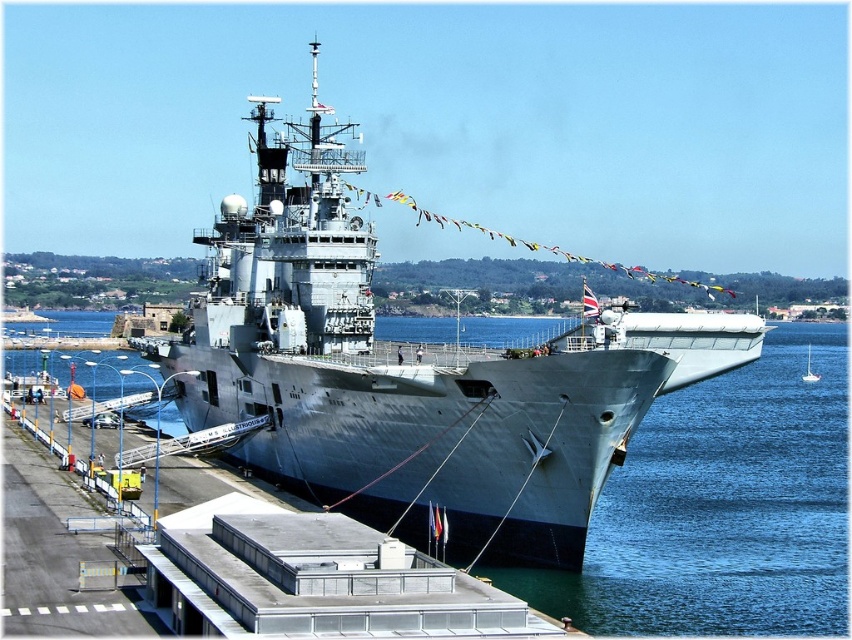
Question: Which object is farther from the camera taking this photo?

Choices:
 (A) gray metallic water at center
 (B) gray metallic ship at center

Answer: (A)

Question: Can you confirm if gray metallic ship at center is smaller than white glossy sailboat at center?

Choices:
 (A) yes
 (B) no

Answer: (B)

Question: Which object is closer to the camera taking this photo?

Choices:
 (A) gray metallic ship at center
 (B) white glossy sailboat at center
 (C) gray metallic water at center

Answer: (A)

Question: From the image, what is the correct spatial relationship of gray metallic ship at center in relation to gray metallic water at center?

Choices:
 (A) below
 (B) above

Answer: (B)

Question: Which is nearer to the white glossy sailboat at center?

Choices:
 (A) gray metallic ship at center
 (B) gray metallic water at center

Answer: (B)

Question: Does gray metallic ship at center come in front of gray metallic water at center?

Choices:
 (A) yes
 (B) no

Answer: (A)